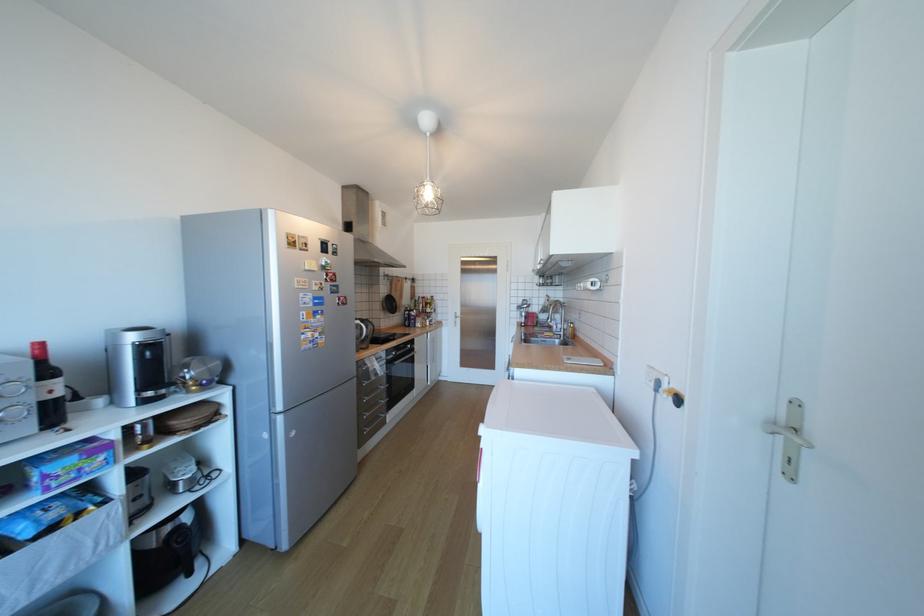
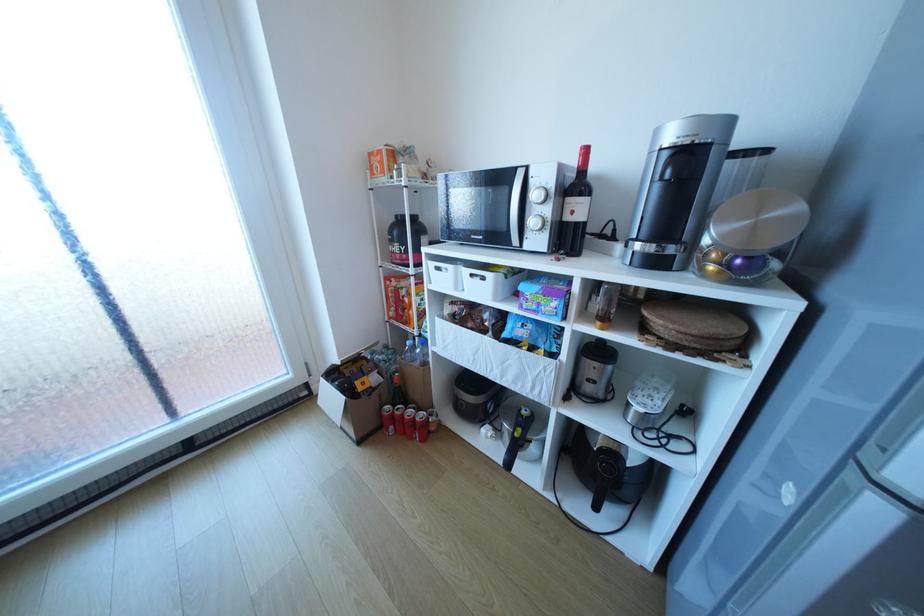
Where in the second image is the point corresponding to [189,578] from the first image?

(599, 499)